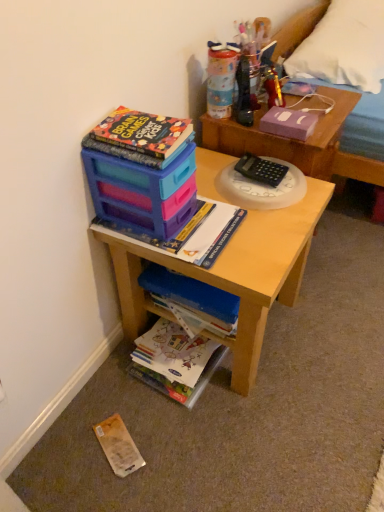
This screenshot has width=384, height=512. What are the coordinates of `empty space that is ontop of hardcover book at upper left, the 4th book from the bottom` in the screenshot? It's located at (120, 115).